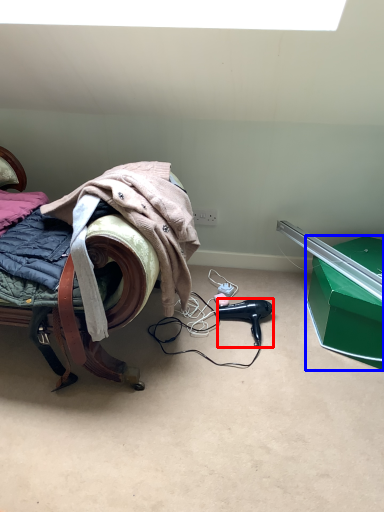
Question: Among these objects, which one is nearest to the camera, hair dryer (highlighted by a red box) or box (highlighted by a blue box)?

Choices:
 (A) hair dryer
 (B) box

Answer: (B)